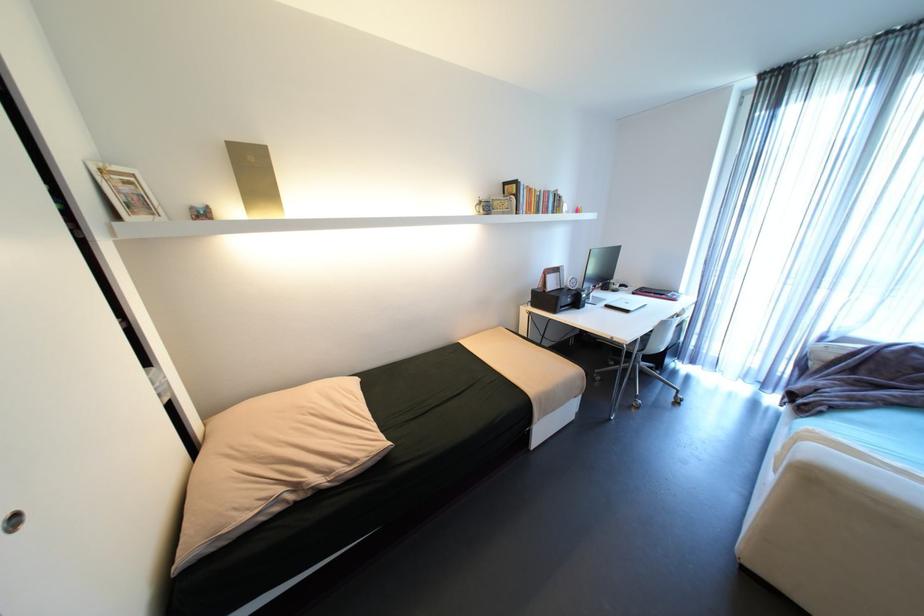
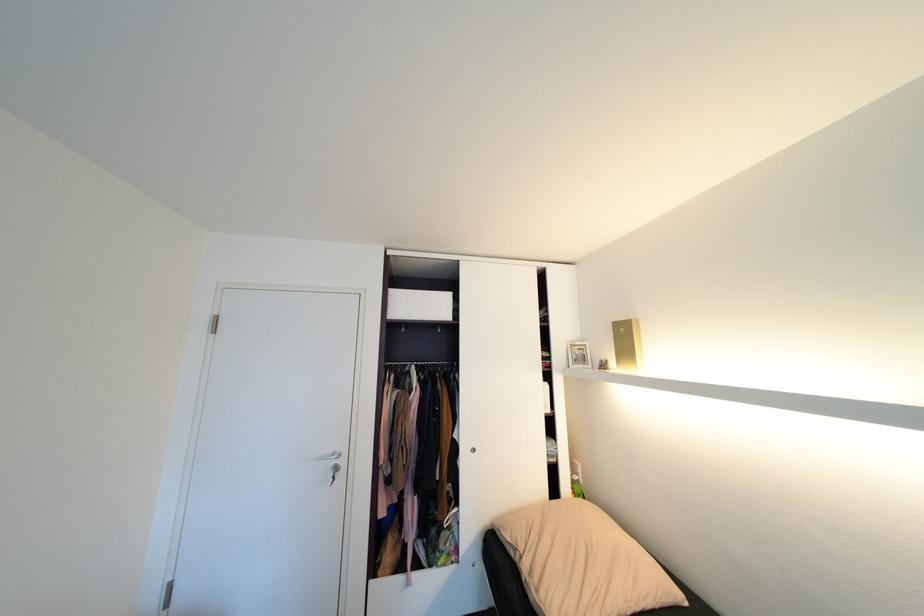
The point at (235, 142) is marked in the first image. Where is the corresponding point in the second image?

(621, 323)